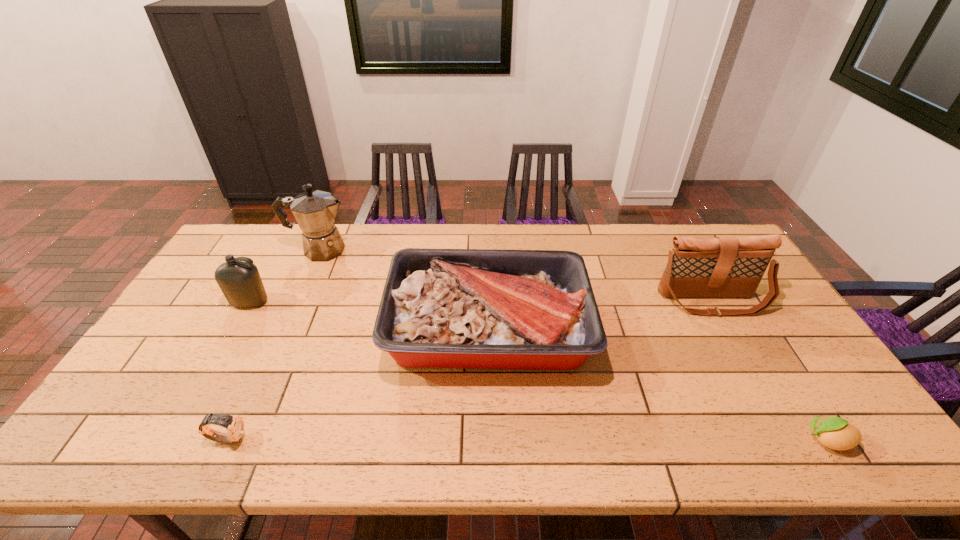
Where is `coffeepot`? coffeepot is located at coordinates (315, 211).

This screenshot has height=540, width=960. Find the location of `the fifth shortest object`. the fifth shortest object is located at coordinates [x=721, y=266].

In order to click on bottle in this screenshot , I will do `click(240, 282)`.

You are a GUI agent. You are given a task and a screenshot of the screen. Output one action in this format:
    pyautogui.click(x=<x>, y=<y>)
    Task: Click on the tray
    
    Given the screenshot: What is the action you would take?
    pyautogui.click(x=441, y=308)

Where is `watch`? watch is located at coordinates (235, 425).

Find the location of a particular element. Image resolution: width=960 pixels, height=540 pixels. the shortest object is located at coordinates (836, 433).

Locate an element on the screen. The width and height of the screenshot is (960, 540). vacant space located on the pouring side of the coffeepot is located at coordinates (436, 250).

You are a GUI agent. You are given a task and a screenshot of the screen. Output one action in this format:
    pyautogui.click(x=<x>, y=<y>)
    Task: Click on the free location located on the front-facing side of the shoulder bag
    The width and height of the screenshot is (960, 540).
    Given the screenshot: What is the action you would take?
    pyautogui.click(x=777, y=417)

This screenshot has height=540, width=960. What are the coordinates of `blank area located on the right of the bottle` in the screenshot? It's located at (386, 302).

Image resolution: width=960 pixels, height=540 pixels. Find the location of `free space located 0.060m on the left of the fourth object from left to right`. free space located 0.060m on the left of the fourth object from left to right is located at coordinates (368, 327).